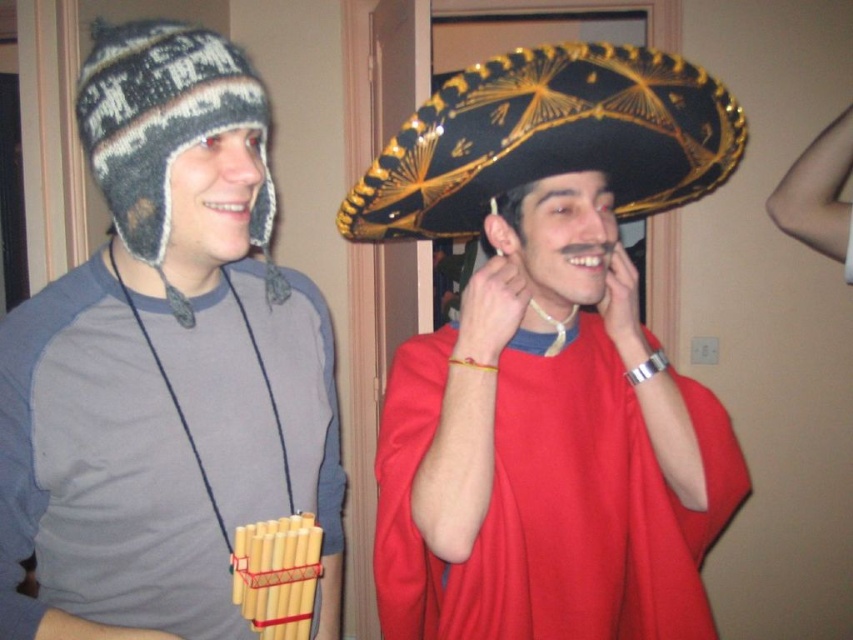
You are a fashion designer analyzing headwear in an image. You see a black felt sombrero at center and a knitted woolen beanie at left. Which headwear item is taller in the image?

The knitted woolen beanie at left is taller than the black felt sombrero at center.

You are standing in the hallway and see two points marked on the wall. The first point is at position point (18, 381) and the second is at point (631, 180). Which point is closer to you?

Point (18, 381) is in front of point (631, 180), so it is closer to you.